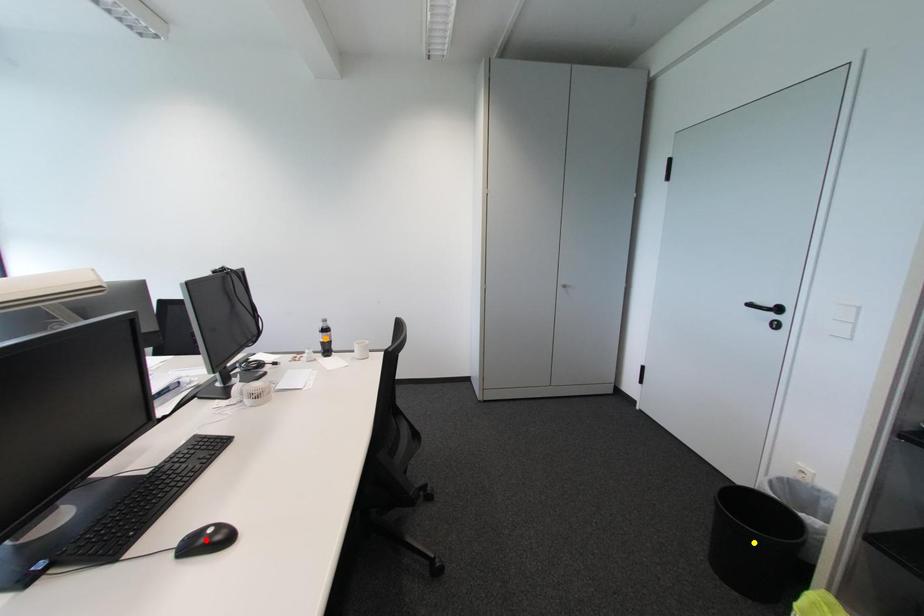
Order these from farthest to nearest:
1. yellow point
2. red point
3. orange point

orange point, yellow point, red point